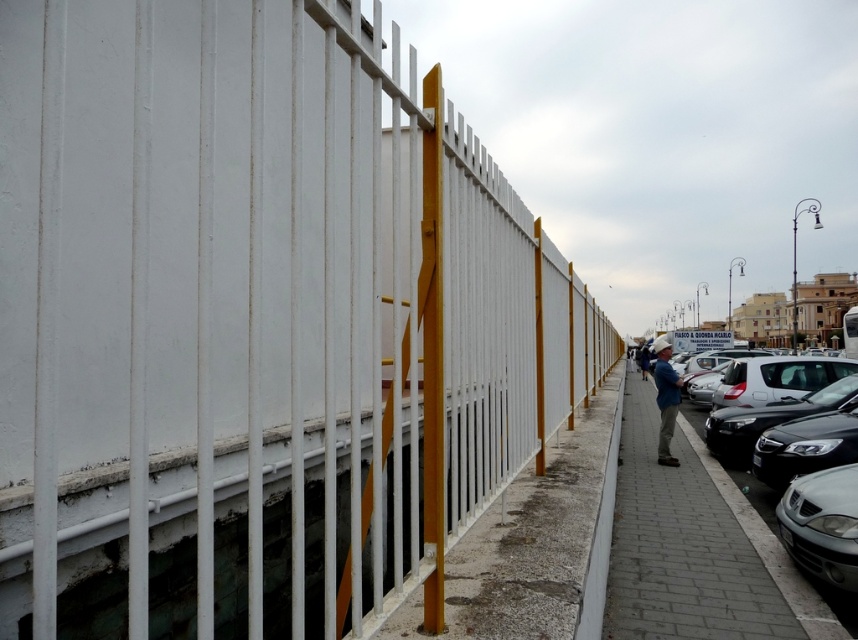
Is white plastic fence at center wider than concrete at center?

In fact, white plastic fence at center might be narrower than concrete at center.

Does white plastic fence at center appear under concrete at center?

Incorrect, white plastic fence at center is not positioned below concrete at center.

The width and height of the screenshot is (858, 640). I want to click on white plastic fence at center, so click(257, 323).

Between white plastic fence at center and gray concrete sidewalk at center, which one is positioned lower?

Positioned lower is gray concrete sidewalk at center.

Which of these two, white plastic fence at center or gray concrete sidewalk at center, stands taller?

gray concrete sidewalk at center

Is point (222, 304) in front of point (674, 625)?

Yes.

Image resolution: width=858 pixels, height=640 pixels. What are the coordinates of `white plastic fence at center` in the screenshot? It's located at (257, 323).

Does gray concrete sidewalk at center have a lesser height compared to concrete at center?

In fact, gray concrete sidewalk at center may be taller than concrete at center.

How distant is gray concrete sidewalk at center from concrete at center?

gray concrete sidewalk at center and concrete at center are 4.35 meters apart from each other.

Which is in front, point (692, 552) or point (512, 624)?

Point (512, 624)

Image resolution: width=858 pixels, height=640 pixels. What are the coordinates of `gray concrete sidewalk at center` in the screenshot? It's located at pyautogui.click(x=683, y=545).